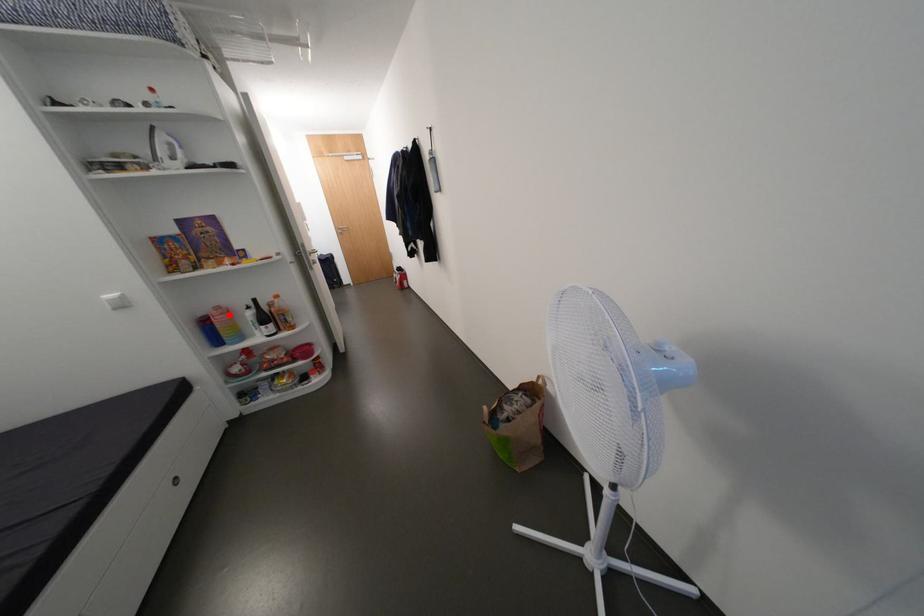
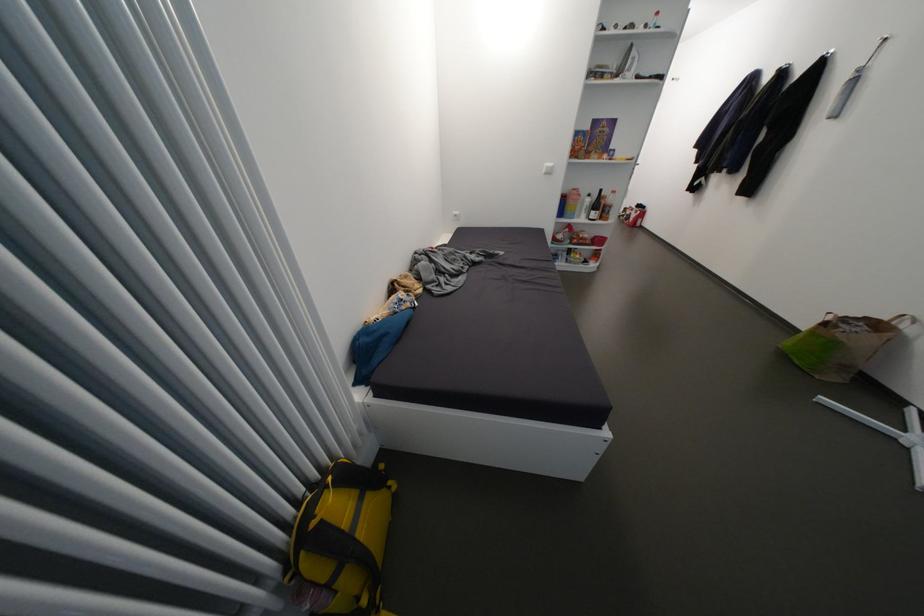
Question: I am providing you with two images of the same scene from different viewpoints. In image1, a red point is highlighted. Considering the same 3D point in image2, which of the following is correct?

Choices:
 (A) It is closer
 (B) It is farther

Answer: (A)